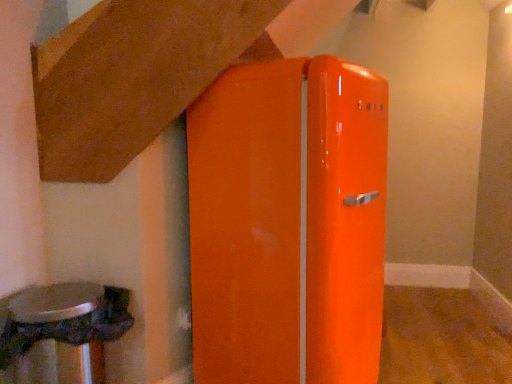
Describe the element at coordinates (60, 334) in the screenshot. I see `metallic silver step stool at lower left` at that location.

Where is `metallic silver step stool at lower left`? Image resolution: width=512 pixels, height=384 pixels. metallic silver step stool at lower left is located at coordinates (60, 334).

You are a GUI agent. You are given a task and a screenshot of the screen. Output one action in this format:
    pyautogui.click(x=<x>, y=<y>)
    Task: Click on the metallic silver step stool at lower left
    The height and width of the screenshot is (384, 512).
    Given the screenshot: What is the action you would take?
    pyautogui.click(x=60, y=334)